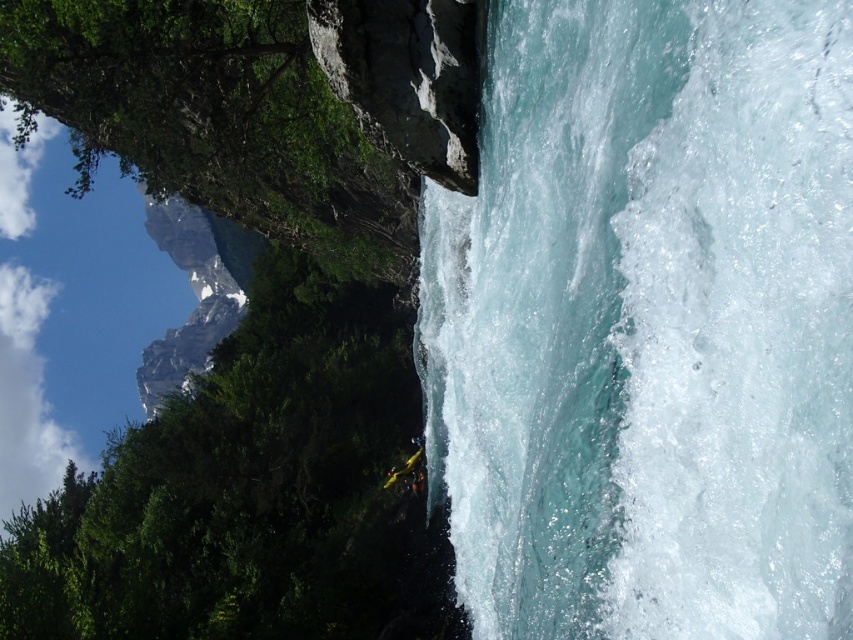
Consider the image. Does clear water at center come in front of yellow plastic kayak at lower center?

Yes, clear water at center is in front of yellow plastic kayak at lower center.

At what (x,y) coordinates should I click in order to perform the action: click on clear water at center. Please return your answer as a coordinate pair (x, y). Looking at the image, I should click on (648, 324).

The width and height of the screenshot is (853, 640). What do you see at coordinates (648, 324) in the screenshot? I see `clear water at center` at bounding box center [648, 324].

I want to click on clear water at center, so click(x=648, y=324).